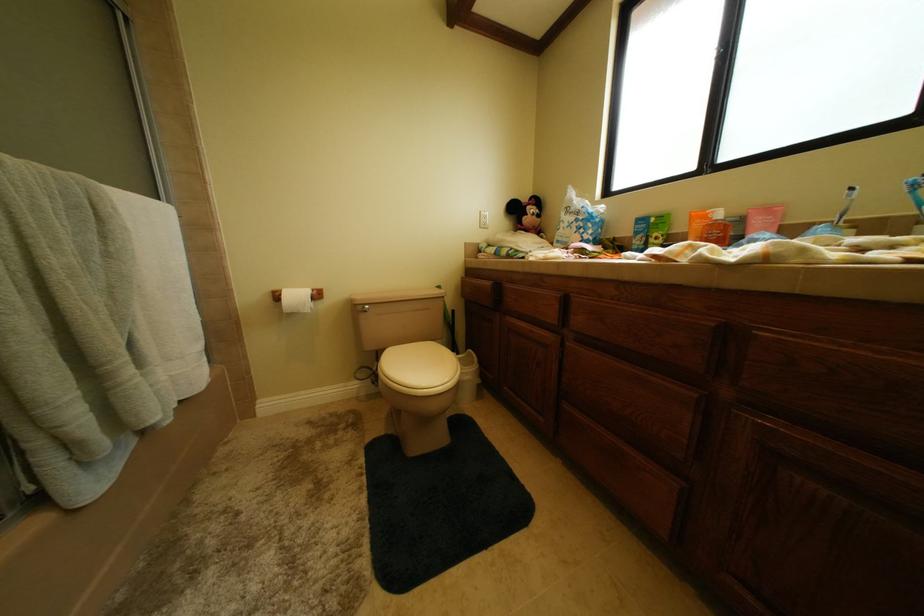
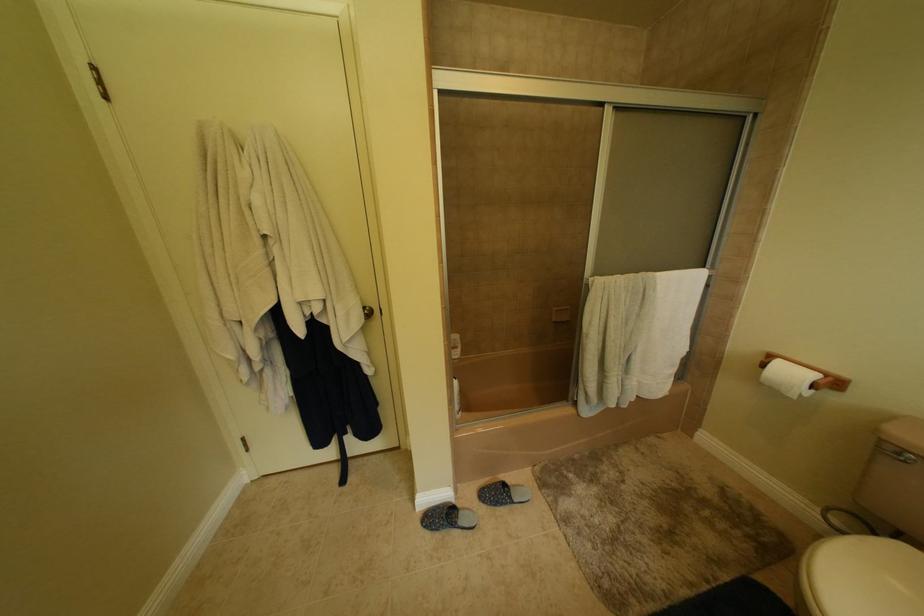
The first image is from the beginning of the video and the second image is from the end. How did the camera likely rotate when shooting the video?

The rotation direction of the camera is left-down.